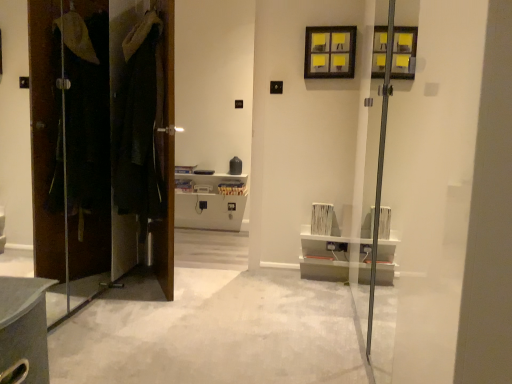
Image resolution: width=512 pixels, height=384 pixels. Identify the location of dark brown leather coat at left, the first door in the right-to-left sequence. (142, 133).

This screenshot has height=384, width=512. What do you see at coordinates (330, 52) in the screenshot?
I see `yellow paper at upper center` at bounding box center [330, 52].

Identify the location of brown wood door at left, placed as the 1th door when sorted from left to right. (102, 140).

Does brown wood door at left, the 2th door positioned from the right, come behind white carpet at center?

Yes, it is.

Which door is the 2nd one when counting from the left side of the white carpet at center? Please provide its 2D coordinates.

[(102, 140)]

From a real-world perspective, which is physically below, brown wood door at left, the 2th door positioned from the right, or white carpet at center?

From a 3D spatial view, white carpet at center is below.

Could white carpet at center be considered to be inside brown wood door at left, the 2th door positioned from the right?

No, white carpet at center is not surrounded by brown wood door at left, the 2th door positioned from the right.

Between brown wood door at left, placed as the 1th door when sorted from left to right, and yellow paper at upper center, which one has larger width?

yellow paper at upper center is wider.

From the image's perspective, is brown wood door at left, the 2th door positioned from the right, positioned above or below yellow paper at upper center?

brown wood door at left, the 2th door positioned from the right, is below yellow paper at upper center.

Measure the distance from brown wood door at left, placed as the 1th door when sorted from left to right, to yellow paper at upper center.

The distance of brown wood door at left, placed as the 1th door when sorted from left to right, from yellow paper at upper center is 1.39 meters.

How different are the orientations of brown wood door at left, placed as the 1th door when sorted from left to right, and yellow paper at upper center in degrees?

brown wood door at left, placed as the 1th door when sorted from left to right, and yellow paper at upper center are facing 90 degrees away from each other.

Considering the sizes of objects yellow paper at upper center and brown wood door at left, the 2th door positioned from the right, in the image provided, who is thinner, yellow paper at upper center or brown wood door at left, the 2th door positioned from the right,?

With smaller width is brown wood door at left, the 2th door positioned from the right.

Is yellow paper at upper center spatially inside brown wood door at left, the 2th door positioned from the right, or outside of it?

yellow paper at upper center is outside brown wood door at left, the 2th door positioned from the right.

Could you tell me if yellow paper at upper center is facing brown wood door at left, the 2th door positioned from the right?

No, yellow paper at upper center is not facing towards brown wood door at left, the 2th door positioned from the right.

Is yellow paper at upper center touching brown wood door at left, the 2th door positioned from the right?

There is a gap between yellow paper at upper center and brown wood door at left, the 2th door positioned from the right.

Is white carpet at center at the back of yellow paper at upper center?

yellow paper at upper center is not turned away from white carpet at center.

At what (x,y) coordinates should I click in order to perform the action: click on window located behind the white carpet at center. Please return your answer as a coordinate pair (x, y). The width and height of the screenshot is (512, 384). Looking at the image, I should click on (x=330, y=52).

How distant is yellow paper at upper center from white carpet at center?

yellow paper at upper center and white carpet at center are 1.73 meters apart.

Between point (336, 62) and point (112, 362), which one is positioned in front?

The point (112, 362) is closer.

Which point is more forward, (165, 54) or (173, 46)?

The point (165, 54) is more forward.

Can you confirm if brown wood door at left, the 2th door positioned from the right, is smaller than dark brown leather coat at left, which appears as the second door when viewed from the left?

Incorrect, brown wood door at left, the 2th door positioned from the right, is not smaller in size than dark brown leather coat at left, which appears as the second door when viewed from the left.

Is brown wood door at left, placed as the 1th door when sorted from left to right, beside dark brown leather coat at left, which appears as the second door when viewed from the left?

Yes, brown wood door at left, placed as the 1th door when sorted from left to right, is next to dark brown leather coat at left, which appears as the second door when viewed from the left.

Is yellow paper at upper center facing away from dark brown leather coat at left, which appears as the second door when viewed from the left?

yellow paper at upper center is not turned away from dark brown leather coat at left, which appears as the second door when viewed from the left.

Relative to dark brown leather coat at left, which appears as the second door when viewed from the left, is yellow paper at upper center in front or behind?

In the image, yellow paper at upper center appears behind dark brown leather coat at left, which appears as the second door when viewed from the left.

Is yellow paper at upper center next to dark brown leather coat at left, the first door in the right-to-left sequence?

No, yellow paper at upper center is not beside dark brown leather coat at left, the first door in the right-to-left sequence.

Considering the positions of point (334, 55) and point (138, 160), is point (334, 55) closer or farther from the camera than point (138, 160)?

Point (334, 55) is positioned farther from the camera compared to point (138, 160).

Between dark brown leather coat at left, the first door in the right-to-left sequence, and brown wood door at left, placed as the 1th door when sorted from left to right, which one has smaller size?

dark brown leather coat at left, the first door in the right-to-left sequence.

You are a GUI agent. You are given a task and a screenshot of the screen. Output one action in this format:
    pyautogui.click(x=<x>, y=<y>)
    Task: Click on the door in front of the dark brown leather coat at left, which appears as the second door when viewed from the left
    This screenshot has height=384, width=512.
    Given the screenshot: What is the action you would take?
    pyautogui.click(x=102, y=140)

Considering the relative sizes of dark brown leather coat at left, the first door in the right-to-left sequence, and brown wood door at left, the 2th door positioned from the right, in the image provided, is dark brown leather coat at left, the first door in the right-to-left sequence, shorter than brown wood door at left, the 2th door positioned from the right,?

Yes.

From the image's perspective, does dark brown leather coat at left, the first door in the right-to-left sequence, appear higher than brown wood door at left, the 2th door positioned from the right?

Yes.

Locate an element on the screen. Image resolution: width=512 pixels, height=384 pixels. door that is the 1st object above the white carpet at center (from a real-world perspective) is located at coordinates (102, 140).

The image size is (512, 384). I want to click on the 2nd door below the yellow paper at upper center (from the image's perspective), so click(x=102, y=140).

Which object lies further to the anchor point yellow paper at upper center, dark brown leather coat at left, which appears as the second door when viewed from the left, or white carpet at center?

Based on the image, white carpet at center appears to be further to yellow paper at upper center.

Based on their spatial positions, is dark brown leather coat at left, the first door in the right-to-left sequence, or yellow paper at upper center further from white carpet at center?

The object further to white carpet at center is yellow paper at upper center.

Considering their positions, is brown wood door at left, placed as the 1th door when sorted from left to right, positioned further to dark brown leather coat at left, which appears as the second door when viewed from the left, than white carpet at center?

white carpet at center is positioned further to the anchor dark brown leather coat at left, which appears as the second door when viewed from the left.

Considering their positions, is brown wood door at left, the 2th door positioned from the right, positioned closer to yellow paper at upper center than white carpet at center?

The object closer to yellow paper at upper center is brown wood door at left, the 2th door positioned from the right.

From the image, which object appears to be nearer to yellow paper at upper center, white carpet at center or brown wood door at left, placed as the 1th door when sorted from left to right?

Based on the image, brown wood door at left, placed as the 1th door when sorted from left to right, appears to be nearer to yellow paper at upper center.

Considering their positions, is dark brown leather coat at left, which appears as the second door when viewed from the left, positioned further to brown wood door at left, placed as the 1th door when sorted from left to right, than white carpet at center?

white carpet at center is positioned further to the anchor brown wood door at left, placed as the 1th door when sorted from left to right.

Considering their positions, is yellow paper at upper center positioned closer to dark brown leather coat at left, the first door in the right-to-left sequence, than brown wood door at left, the 2th door positioned from the right?

brown wood door at left, the 2th door positioned from the right, lies closer to dark brown leather coat at left, the first door in the right-to-left sequence, than the other object.

When comparing their distances from dark brown leather coat at left, which appears as the second door when viewed from the left, does yellow paper at upper center or white carpet at center seem closer?

Based on the image, white carpet at center appears to be nearer to dark brown leather coat at left, which appears as the second door when viewed from the left.

Find the location of `door between dark brown leather coat at left, the first door in the right-to-left sequence, and white carpet at center vertically`. door between dark brown leather coat at left, the first door in the right-to-left sequence, and white carpet at center vertically is located at coordinates (102, 140).

Find the location of a particular element. door situated between brown wood door at left, the 2th door positioned from the right, and yellow paper at upper center from left to right is located at coordinates (142, 133).